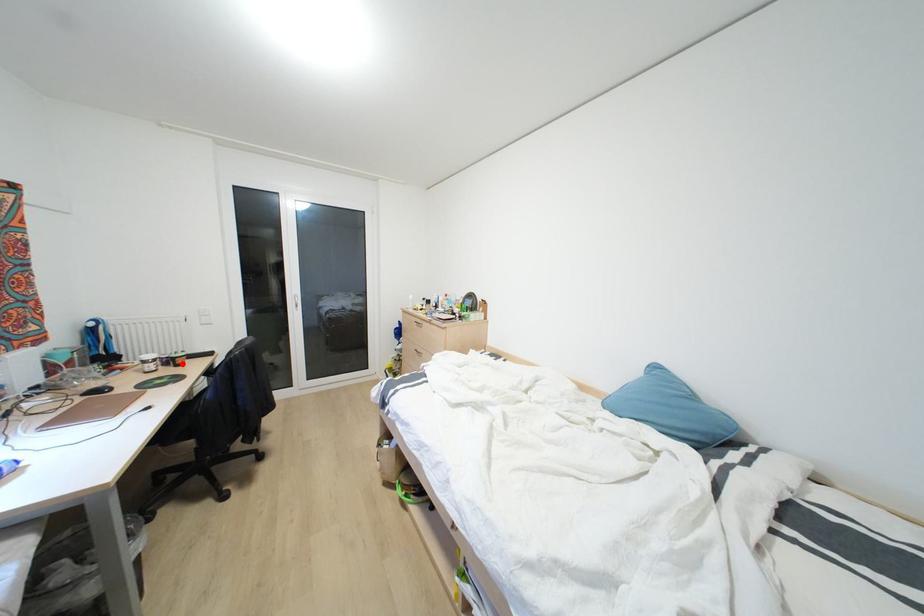
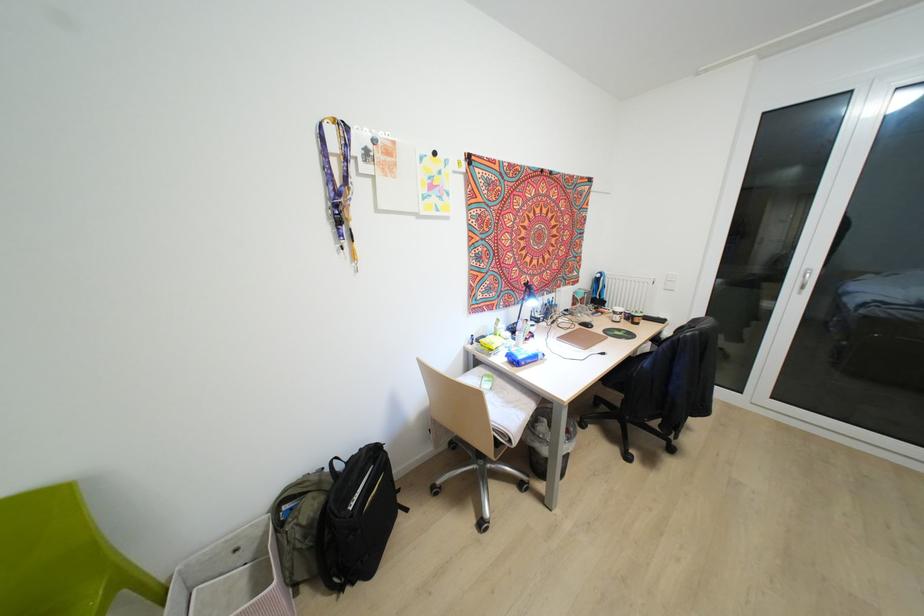
Where in the second image is the point corresponding to the highlighted location from the first image?

(637, 323)